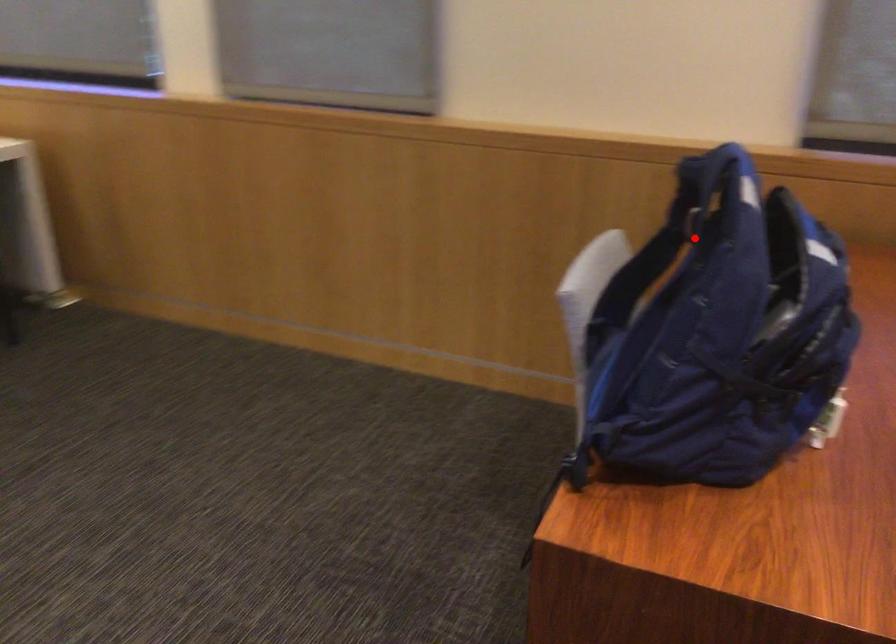
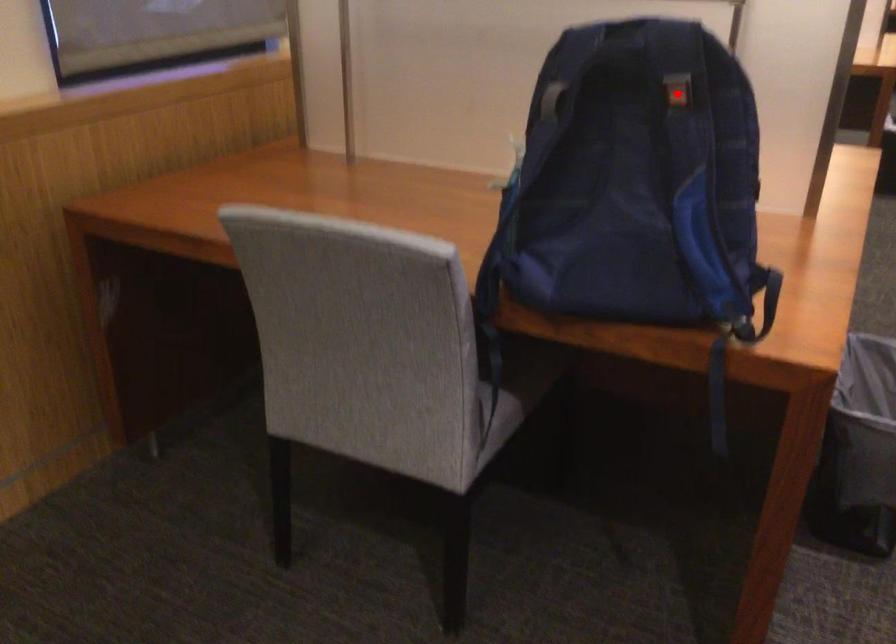
I am providing you with two images of the same scene from different viewpoints. A red point is marked on the first image and another point is marked on the second image. Is the red point in image1 aligned with the point shown in image2?

Yes